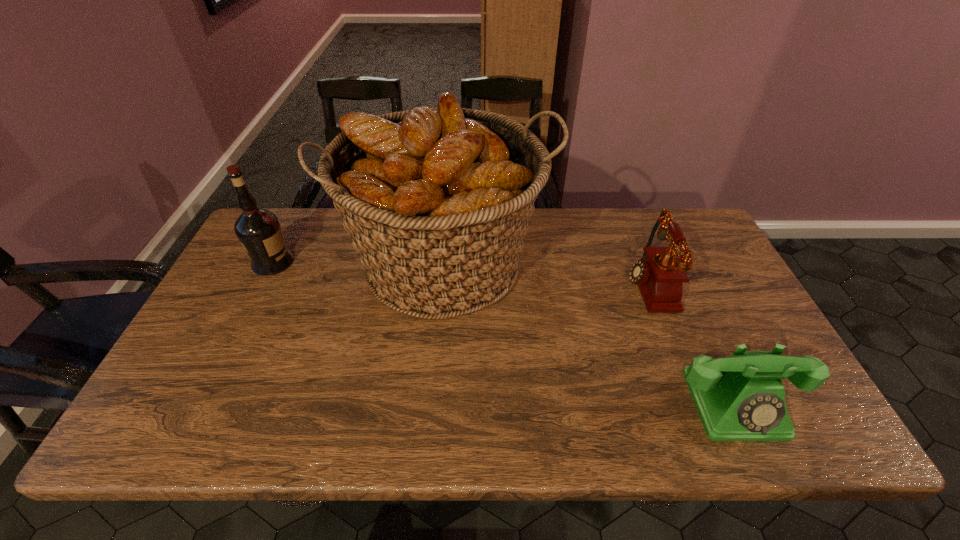
The width and height of the screenshot is (960, 540). Find the location of `the tallest object`. the tallest object is located at coordinates (437, 201).

Where is `basket`? The height and width of the screenshot is (540, 960). basket is located at coordinates (437, 201).

Identify the location of liquor. (258, 230).

You are a GUI agent. You are given a task and a screenshot of the screen. Output one action in this format:
    pyautogui.click(x=<x>, y=<y>)
    Task: Click on the leftmost object
    The height and width of the screenshot is (540, 960).
    Given the screenshot: What is the action you would take?
    pyautogui.click(x=258, y=230)

Where is `the third tallest object`? Image resolution: width=960 pixels, height=540 pixels. the third tallest object is located at coordinates (660, 273).

Locate an element on the screen. Image resolution: width=960 pixels, height=540 pixels. the taller telephone is located at coordinates (660, 273).

I want to click on the shorter telephone, so click(739, 398).

You are a GUI agent. You are given a task and a screenshot of the screen. Output one action in this format:
    pyautogui.click(x=<x>, y=<y>)
    Task: Click on the nearer telephone
    This screenshot has height=540, width=960.
    Given the screenshot: What is the action you would take?
    pyautogui.click(x=739, y=398)

Identify the location of vacant area situated 0.050m on the right of the basket. The width and height of the screenshot is (960, 540). (566, 263).

Find the location of `vacant region located 0.140m on the surface of the liquor`. vacant region located 0.140m on the surface of the liquor is located at coordinates (339, 263).